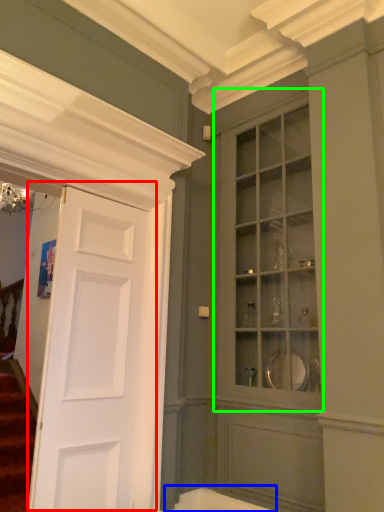
Question: Considering the real-world distances, which object is closest to door (highlighted by a red box)? bath (highlighted by a blue box) or cabinetry (highlighted by a green box).

Choices:
 (A) bath
 (B) cabinetry

Answer: (A)